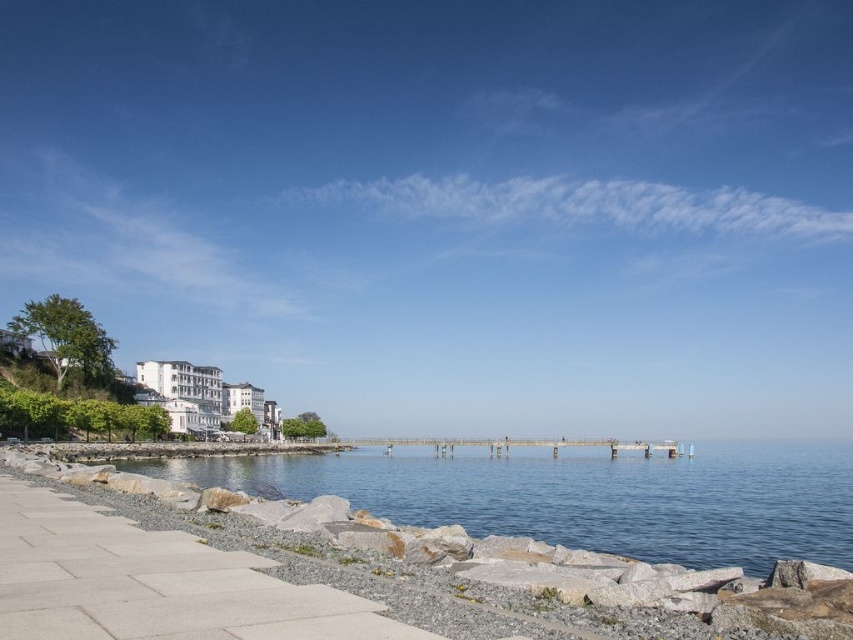
Question: Is clear blue water at center smaller than gray concrete pavement at lower left?

Choices:
 (A) yes
 (B) no

Answer: (B)

Question: Which object appears closest to the camera in this image?

Choices:
 (A) gray concrete pavement at lower left
 (B) clear blue water at center

Answer: (A)

Question: Which object appears farthest from the camera in this image?

Choices:
 (A) clear blue water at center
 (B) gray concrete pavement at lower left

Answer: (A)

Question: Is clear blue water at center to the left of gray concrete pavement at lower left from the viewer's perspective?

Choices:
 (A) yes
 (B) no

Answer: (B)

Question: Can you confirm if clear blue water at center is bigger than gray concrete pavement at lower left?

Choices:
 (A) yes
 (B) no

Answer: (A)

Question: Which point is closer to the camera?

Choices:
 (A) (238, 468)
 (B) (108, 616)

Answer: (B)